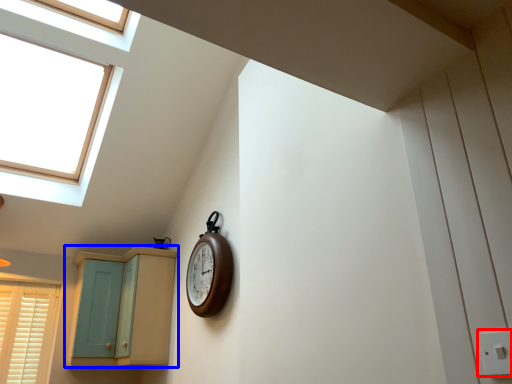
Question: Which of the following is the closest to the observer, electric outlet (highlighted by a red box) or cabinetry (highlighted by a blue box)?

Choices:
 (A) electric outlet
 (B) cabinetry

Answer: (A)